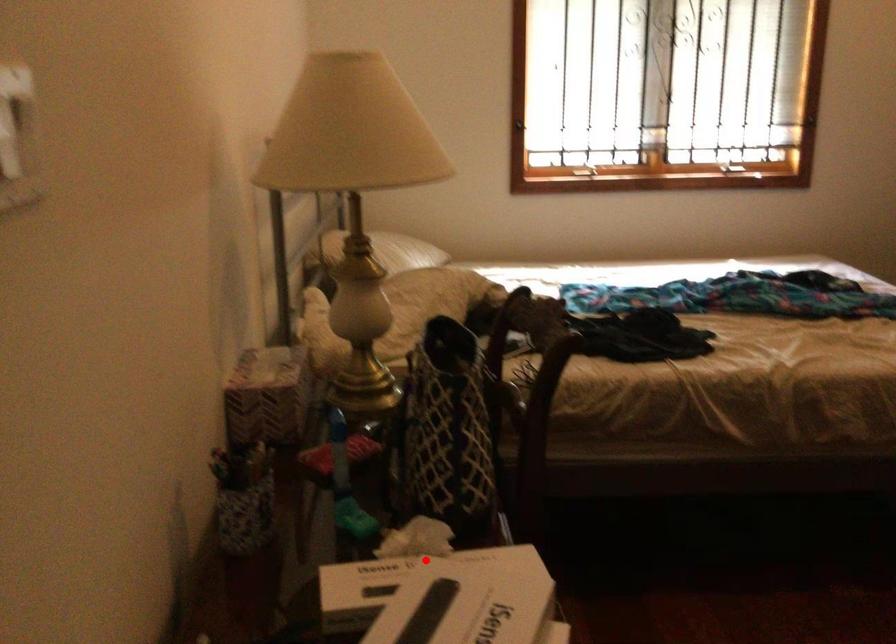
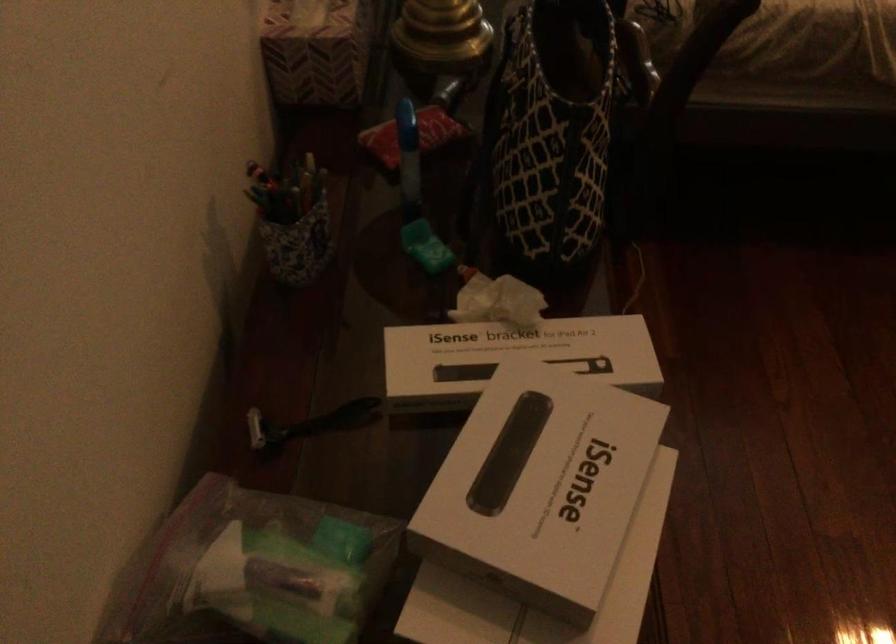
Question: I am providing you with two images of the same scene from different viewpoints. A red point is shown in image1. For the corresponding object point in image2, is it positioned nearer or farther from the camera?

Choices:
 (A) Nearer
 (B) Farther

Answer: (A)